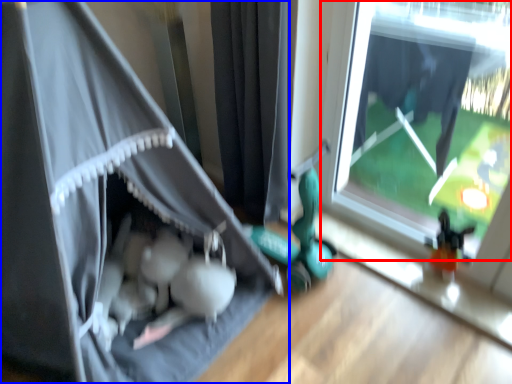
Question: Which point is further to the camera, window (highlighted by a red box) or curtain (highlighted by a blue box)?

Choices:
 (A) window
 (B) curtain

Answer: (A)